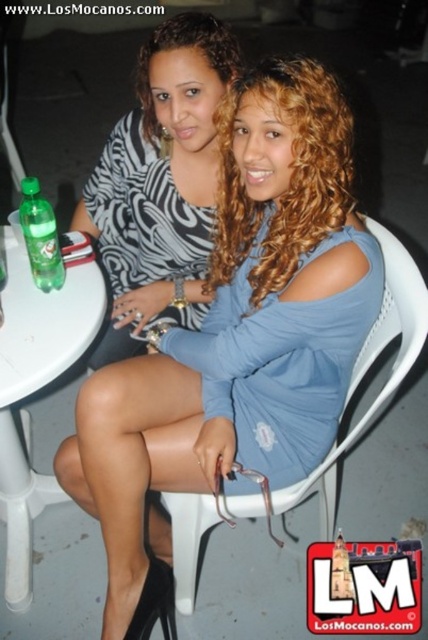
Based on the photo, you are a delivery robot with a 1 meter long package. You are standing in front of the white plastic chair at center. Can you place the package on the ground between yourself and the chair without it overlapping?

The distance between the white plastic chair at center and the viewer is 85.89 centimeters. Since the package is 1 meter long, it would extend beyond the space available, so placing it there would cause overlap. Choose another spot.

You are sitting at the table and want to grab the green matte plastic bottle at left without moving your chair. Can you reach it if you are currently sitting on the white plastic chair at center?

The white plastic chair at center is to the right of the green matte plastic bottle at left, so yes, you can reach the green matte plastic bottle at left from the white plastic chair at center without moving your chair.